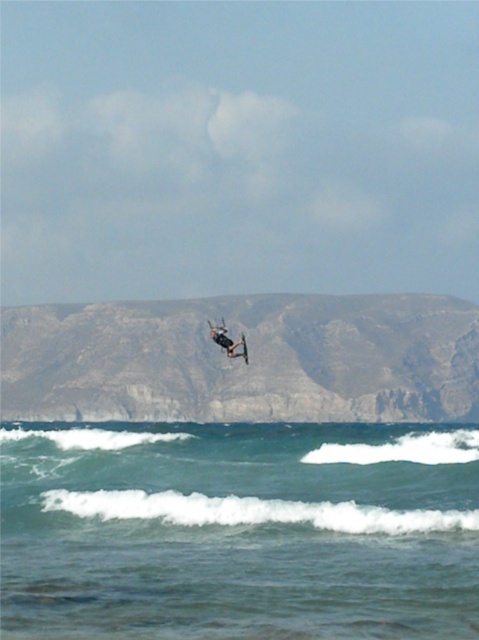
Question: Is black matte surfboard at center positioned behind smooth black surfboard at center?

Choices:
 (A) no
 (B) yes

Answer: (A)

Question: Is black matte surfboard at center to the right of smooth black surfboard at center from the viewer's perspective?

Choices:
 (A) no
 (B) yes

Answer: (A)

Question: Which of the following is the farthest from the observer?

Choices:
 (A) (243, 358)
 (B) (234, 348)
 (C) (368, 515)

Answer: (A)

Question: Does blue water at center appear on the right side of black matte surfboard at center?

Choices:
 (A) no
 (B) yes

Answer: (A)

Question: Which object appears farthest from the camera in this image?

Choices:
 (A) blue water at center
 (B) smooth black surfboard at center

Answer: (B)

Question: Which of the following is the farthest from the observer?

Choices:
 (A) click(x=244, y=353)
 (B) click(x=251, y=561)
 (C) click(x=218, y=337)

Answer: (A)